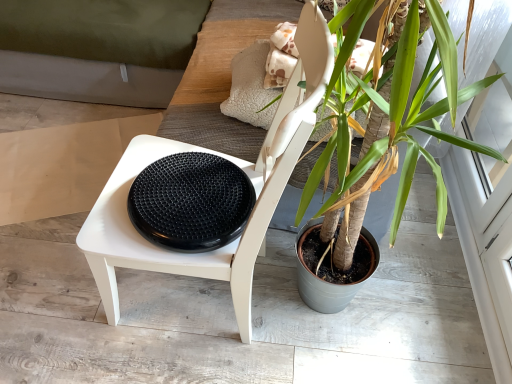
Question: Is green leafy plant at center next to black rubber footrest at center?

Choices:
 (A) no
 (B) yes

Answer: (A)

Question: Can you confirm if green leafy plant at center is smaller than black rubber footrest at center?

Choices:
 (A) no
 (B) yes

Answer: (A)

Question: Is green leafy plant at center further to the viewer compared to black rubber footrest at center?

Choices:
 (A) yes
 (B) no

Answer: (B)

Question: Is green leafy plant at center facing towards black rubber footrest at center?

Choices:
 (A) no
 (B) yes

Answer: (B)

Question: Can you confirm if green leafy plant at center is shorter than black rubber footrest at center?

Choices:
 (A) yes
 (B) no

Answer: (B)

Question: Considering the positions of point (429, 59) and point (165, 253), is point (429, 59) closer or farther from the camera than point (165, 253)?

Choices:
 (A) closer
 (B) farther

Answer: (A)

Question: In the image, is green leafy plant at center on the left side or the right side of white matte chair at center?

Choices:
 (A) right
 (B) left

Answer: (A)

Question: From a real-world perspective, is green leafy plant at center physically located above or below white matte chair at center?

Choices:
 (A) below
 (B) above

Answer: (B)

Question: Looking at their shapes, would you say green leafy plant at center is wider or thinner than white matte chair at center?

Choices:
 (A) wide
 (B) thin

Answer: (A)

Question: Based on their positions, is white matte chair at center located to the left or right of black rubber footrest at center?

Choices:
 (A) left
 (B) right

Answer: (B)

Question: Does point (275, 119) appear closer or farther from the camera than point (151, 218)?

Choices:
 (A) closer
 (B) farther

Answer: (B)

Question: From the image's perspective, is white matte chair at center above or below black rubber footrest at center?

Choices:
 (A) below
 (B) above

Answer: (A)

Question: From a real-world perspective, is white matte chair at center above or below black rubber footrest at center?

Choices:
 (A) above
 (B) below

Answer: (B)

Question: From the image's perspective, is white matte chair at center located above or below green leafy plant at center?

Choices:
 (A) below
 (B) above

Answer: (A)

Question: Based on their positions, is white matte chair at center located to the left or right of green leafy plant at center?

Choices:
 (A) right
 (B) left

Answer: (B)